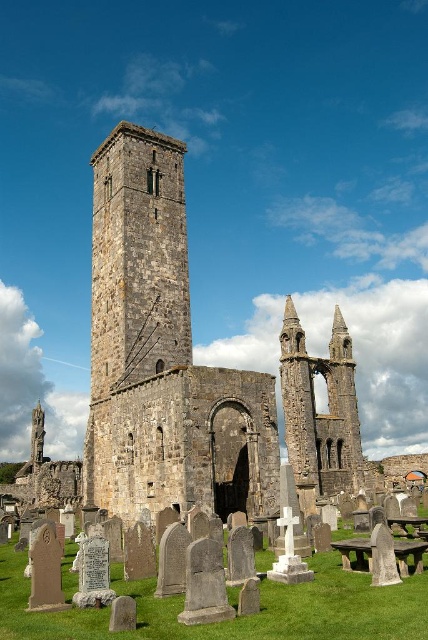
You are standing at the point closest to the viewer in the image of St Andrews Cathedral ruins. Which of the two points, point (x=143, y=192) or point (x=419, y=554), is farther away from you?

Point (x=143, y=192) is behind point (x=419, y=554), so it is farther away from you.

You are visiting the ruins of St Andrews Cathedral and want to take a break. You see a rustic stone tower at center and a wooden picnic table at center. Which object is located to the left side from your perspective?

The rustic stone tower at center is located to the left of the wooden picnic table at center.